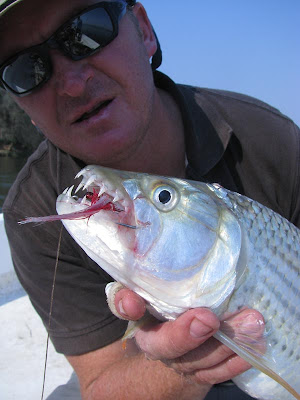
The width and height of the screenshot is (300, 400). I want to click on scales, so click(x=280, y=237).